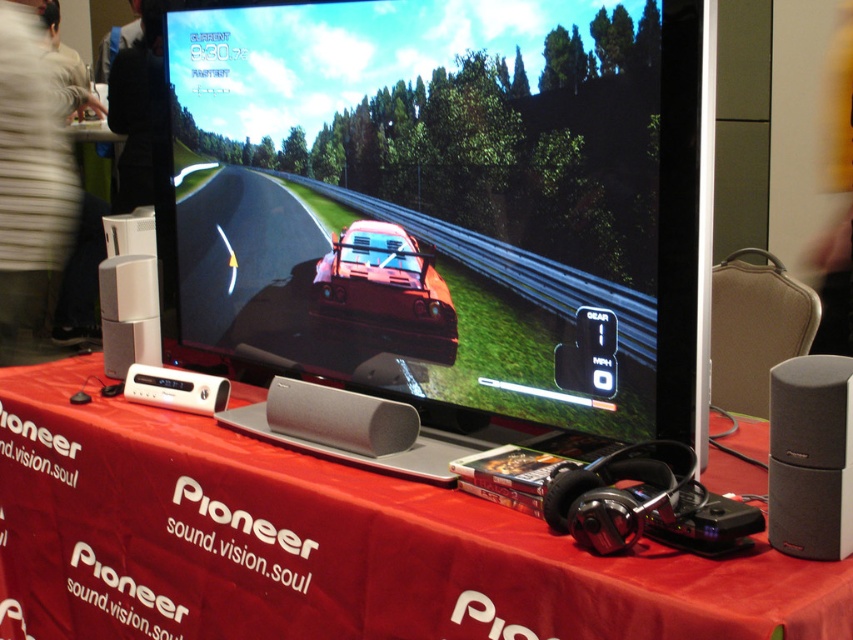
You are at the technology event and want to locate the two points mentioned. According to the image, which point is closer to the viewer, point (x=451, y=595) or point (x=343, y=298)?

Point (x=451, y=595) is in front of point (x=343, y=298), so it is closer to the viewer.

You are at a tech event and see the large flat screen TV showing a racing game. There is a table with red fabric in the center. Where is the point located at coordinates (323,545) on the image?

The point at coordinates (323,545) corresponds to the red fabric table at center.

You are a photographer at the event and want to capture the black matte speaker at right without any obstructions. Is the white striped shirt at upper left blocking the speaker?

The white striped shirt at upper left is positioned over the black matte speaker at right, so it is blocking the speaker. To capture the speaker without obstructions, you would need to adjust the angle or remove the shirt.